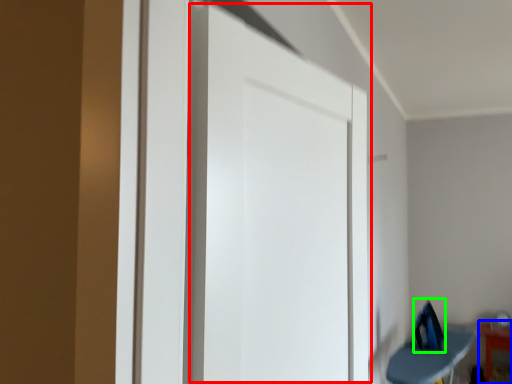
Question: Which is nearer to the door (highlighted by a red box)? furniture (highlighted by a blue box) or swivel chair (highlighted by a green box).

Choices:
 (A) furniture
 (B) swivel chair

Answer: (B)